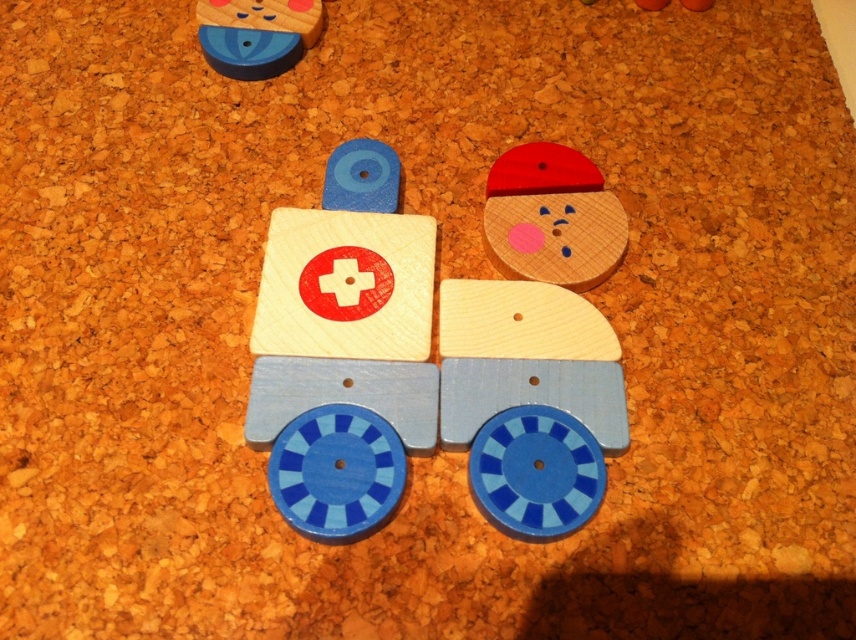
Question: Does wooden ambulance at center have a smaller size compared to wooden face at upper right?

Choices:
 (A) no
 (B) yes

Answer: (A)

Question: In this image, where is wooden face at upper right located relative to matte wood block at upper left?

Choices:
 (A) left
 (B) right

Answer: (B)

Question: Which point is farther to the camera?

Choices:
 (A) wooden ambulance at center
 (B) matte wood block at upper left
 (C) wooden face at upper right

Answer: (B)

Question: Which object is positioned farthest from the matte wood block at upper left?

Choices:
 (A) wooden face at upper right
 (B) wooden ambulance at center

Answer: (B)

Question: Does wooden ambulance at center have a larger size compared to matte wood block at upper left?

Choices:
 (A) yes
 (B) no

Answer: (A)

Question: Considering the real-world distances, which object is farthest from the wooden face at upper right?

Choices:
 (A) matte wood block at upper left
 (B) wooden ambulance at center

Answer: (A)